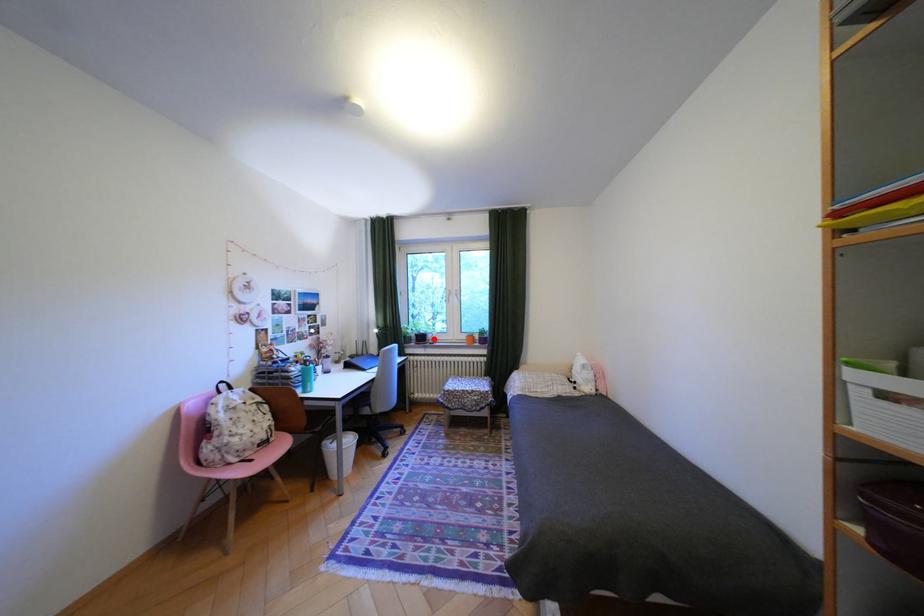
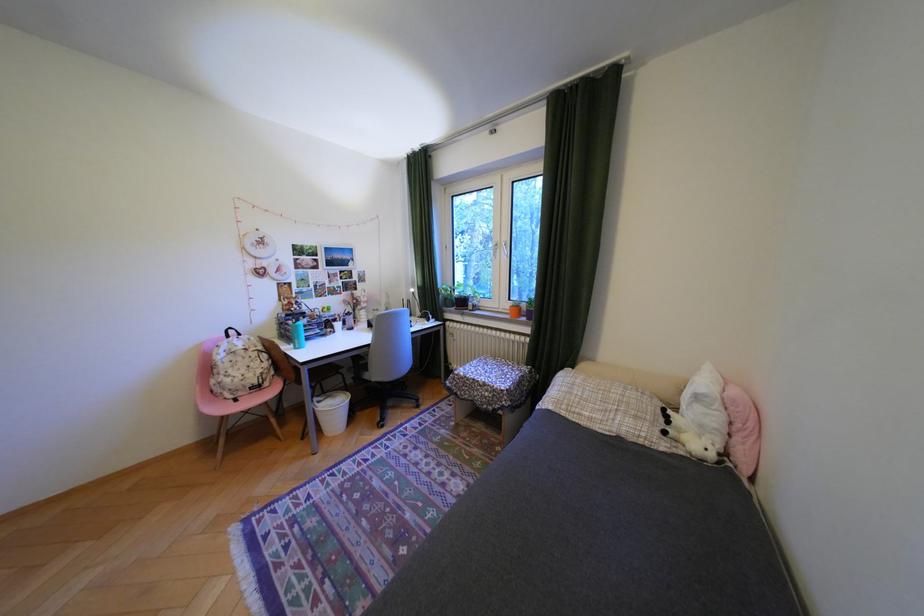
Question: I am providing you with two images of the same scene from different viewpoints. In image1, a red point is highlighted. Considering the same 3D point in image2, which of the following is correct?

Choices:
 (A) It is closer
 (B) It is farther

Answer: (A)